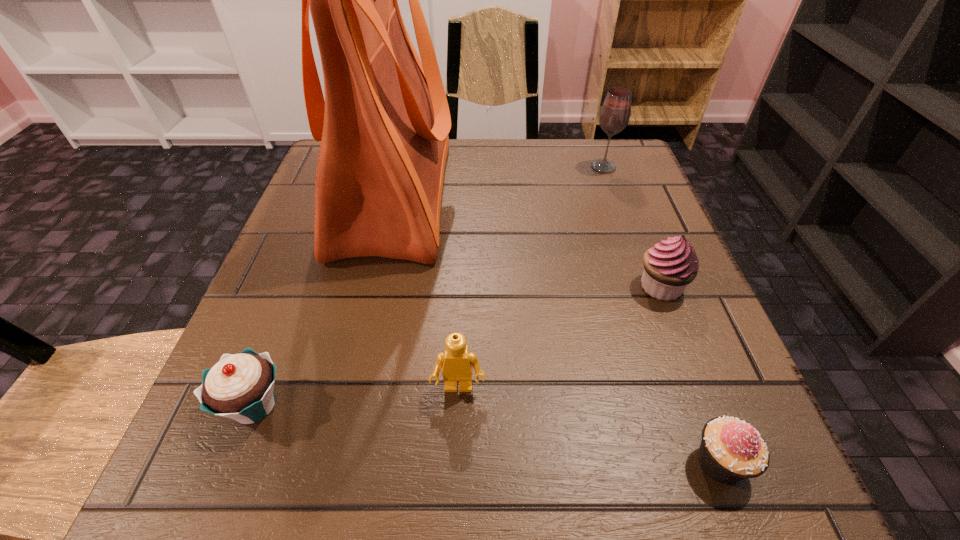
Where is `shopping bag`? The height and width of the screenshot is (540, 960). shopping bag is located at coordinates (384, 125).

Locate an element on the screen. Image resolution: width=960 pixels, height=540 pixels. the fifth shortest object is located at coordinates (614, 116).

The image size is (960, 540). What are the coordinates of `the farthest cupcake` in the screenshot? It's located at (669, 266).

You are a GUI agent. You are given a task and a screenshot of the screen. Output one action in this format:
    pyautogui.click(x=<x>, y=<y>)
    Task: Click on the Lego
    The height and width of the screenshot is (540, 960).
    Given the screenshot: What is the action you would take?
    pyautogui.click(x=457, y=362)

Identify the location of the leftmost cupcake. Image resolution: width=960 pixels, height=540 pixels. (241, 386).

Locate an element on the screen. The width and height of the screenshot is (960, 540). free region located on the front pocket of the tallest object is located at coordinates (542, 195).

In order to click on vacant area situated 0.330m on the front of the glass drink container in this screenshot , I will do `click(643, 280)`.

You are a GUI agent. You are given a task and a screenshot of the screen. Output one action in this format:
    pyautogui.click(x=<x>, y=<y>)
    Task: Click on the vacant space positioned 0.400m on the back of the farthest cupcake
    This screenshot has width=960, height=540.
    Given the screenshot: What is the action you would take?
    pyautogui.click(x=609, y=152)

Identify the location of vacant space located 0.110m on the face of the Lego. The height and width of the screenshot is (540, 960). (455, 483).

The height and width of the screenshot is (540, 960). I want to click on vacant space located 0.060m on the right of the leftmost cupcake, so (333, 405).